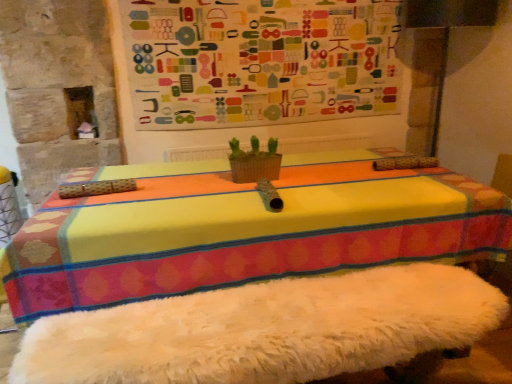
Where is `multicolored fabric bulletin board at upper center`? The width and height of the screenshot is (512, 384). multicolored fabric bulletin board at upper center is located at coordinates (260, 61).

Describe the element at coordinates (260, 61) in the screenshot. I see `multicolored fabric bulletin board at upper center` at that location.

Describe the element at coordinates (255, 166) in the screenshot. I see `woven basket at center` at that location.

In order to click on woven basket at center in this screenshot , I will do `click(255, 166)`.

Find the location of a particular element. multicolored fabric bulletin board at upper center is located at coordinates (260, 61).

Based on their positions, is woven basket at center located to the left or right of multicolored fabric bulletin board at upper center?

woven basket at center is positioned on multicolored fabric bulletin board at upper center's left side.

Considering the positions of objects woven basket at center and multicolored fabric bulletin board at upper center in the image provided, who is in front, woven basket at center or multicolored fabric bulletin board at upper center?

woven basket at center is more forward.

Considering the points (277, 169) and (150, 109), which point is behind, point (277, 169) or point (150, 109)?

The point (150, 109) is farther.

From the image's perspective, which one is positioned higher, woven basket at center or multicolored fabric bulletin board at upper center?

multicolored fabric bulletin board at upper center.

From a real-world perspective, is woven basket at center located beneath multicolored fabric bulletin board at upper center?

Indeed, from a real-world perspective, woven basket at center is positioned beneath multicolored fabric bulletin board at upper center.

Does woven basket at center have a greater width compared to multicolored fabric bulletin board at upper center?

Correct, the width of woven basket at center exceeds that of multicolored fabric bulletin board at upper center.

Does woven basket at center have a greater height compared to multicolored fabric bulletin board at upper center?

No.

Considering the relative sizes of woven basket at center and multicolored fabric bulletin board at upper center in the image provided, is woven basket at center smaller than multicolored fabric bulletin board at upper center?

Indeed, woven basket at center has a smaller size compared to multicolored fabric bulletin board at upper center.

Is woven basket at center inside or outside of multicolored fabric bulletin board at upper center?

woven basket at center is spatially situated outside multicolored fabric bulletin board at upper center.

Is woven basket at center next to multicolored fabric bulletin board at upper center?

No, woven basket at center is not next to multicolored fabric bulletin board at upper center.

Is woven basket at center facing away from multicolored fabric bulletin board at upper center?

Yes, woven basket at center is positioned with its back facing multicolored fabric bulletin board at upper center.

How many degrees apart are the facing directions of woven basket at center and multicolored fabric bulletin board at upper center?

They differ by 1.72 degrees in their facing directions.

What are the coordinates of `flowerpot on the left of multicolored fabric bulletin board at upper center` in the screenshot? It's located at (255, 166).

Between multicolored fabric bulletin board at upper center and woven basket at center, which one appears on the left side from the viewer's perspective?

From the viewer's perspective, woven basket at center appears more on the left side.

Between multicolored fabric bulletin board at upper center and woven basket at center, which one is positioned in front?

woven basket at center is more forward.

Which is nearer, (156, 10) or (234, 181)?

Point (156, 10) appears to be farther away from the viewer than point (234, 181).

From the image's perspective, relative to woven basket at center, is multicolored fabric bulletin board at upper center above or below?

Based on their image positions, multicolored fabric bulletin board at upper center is located above woven basket at center.

From a real-world perspective, between multicolored fabric bulletin board at upper center and woven basket at center, who is vertically higher?

multicolored fabric bulletin board at upper center, from a real-world perspective.

Can you confirm if multicolored fabric bulletin board at upper center is wider than woven basket at center?

Incorrect, the width of multicolored fabric bulletin board at upper center does not surpass that of woven basket at center.

Is multicolored fabric bulletin board at upper center taller than woven basket at center?

Yes.

Considering the relative sizes of multicolored fabric bulletin board at upper center and woven basket at center in the image provided, is multicolored fabric bulletin board at upper center bigger than woven basket at center?

Yes.

Is multicolored fabric bulletin board at upper center situated inside woven basket at center or outside?

multicolored fabric bulletin board at upper center is not inside woven basket at center, it's outside.

Is multicolored fabric bulletin board at upper center beside woven basket at center?

No, multicolored fabric bulletin board at upper center is not touching woven basket at center.

Could you tell me if multicolored fabric bulletin board at upper center is turned towards woven basket at center?

Yes.

How much distance is there between multicolored fabric bulletin board at upper center and woven basket at center?

The distance of multicolored fabric bulletin board at upper center from woven basket at center is 97.24 centimeters.

Identify the location of flowerpot in front of the multicolored fabric bulletin board at upper center. The width and height of the screenshot is (512, 384). (255, 166).

Find the location of a particular element. bulletin board behind the woven basket at center is located at coordinates (260, 61).

Image resolution: width=512 pixels, height=384 pixels. I want to click on flowerpot below the multicolored fabric bulletin board at upper center (from the image's perspective), so click(255, 166).